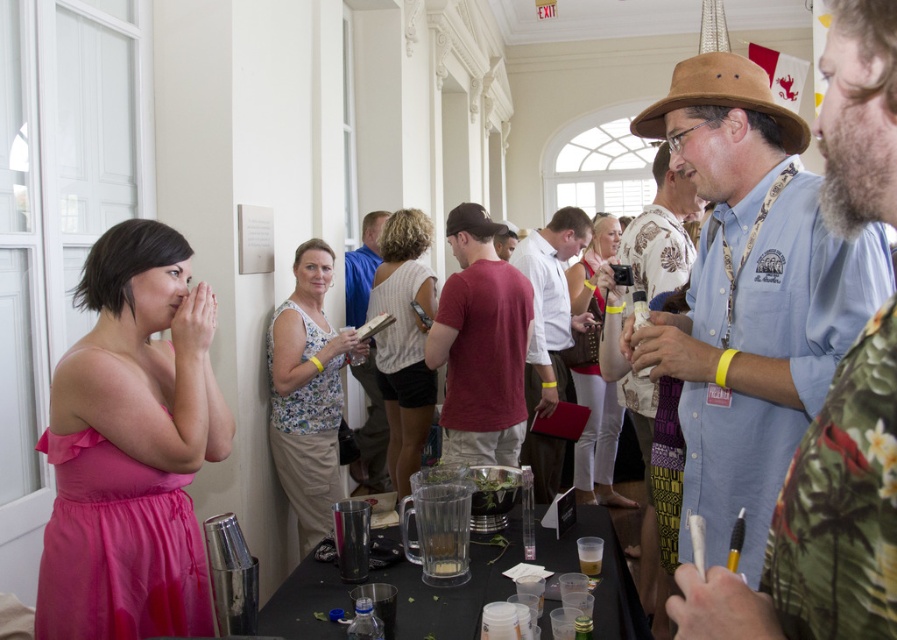
Who is positioned more to the right, pink satin dress at left or floral print tank top at center?

From the viewer's perspective, floral print tank top at center appears more on the right side.

Who is positioned more to the left, pink satin dress at left or floral print tank top at center?

pink satin dress at left is more to the left.

Locate an element on the screen. Image resolution: width=897 pixels, height=640 pixels. pink satin dress at left is located at coordinates (131, 448).

Between blue button-down shirt at center-right and white shirt at center, which one has less height?

blue button-down shirt at center-right is shorter.

Measure the distance between blue button-down shirt at center-right and camera.

blue button-down shirt at center-right is 4.19 feet from camera.

What do you see at coordinates (749, 296) in the screenshot? I see `blue button-down shirt at center-right` at bounding box center [749, 296].

Identify the location of blue button-down shirt at center-right. click(749, 296).

Between transparent plastic table at lower center and translucent plastic cup at lower center, which one has less height?

translucent plastic cup at lower center is shorter.

Describe the element at coordinates (454, 588) in the screenshot. This screenshot has height=640, width=897. I see `transparent plastic table at lower center` at that location.

Where is `transparent plastic table at lower center`? transparent plastic table at lower center is located at coordinates (454, 588).

The height and width of the screenshot is (640, 897). I want to click on transparent plastic table at lower center, so click(454, 588).